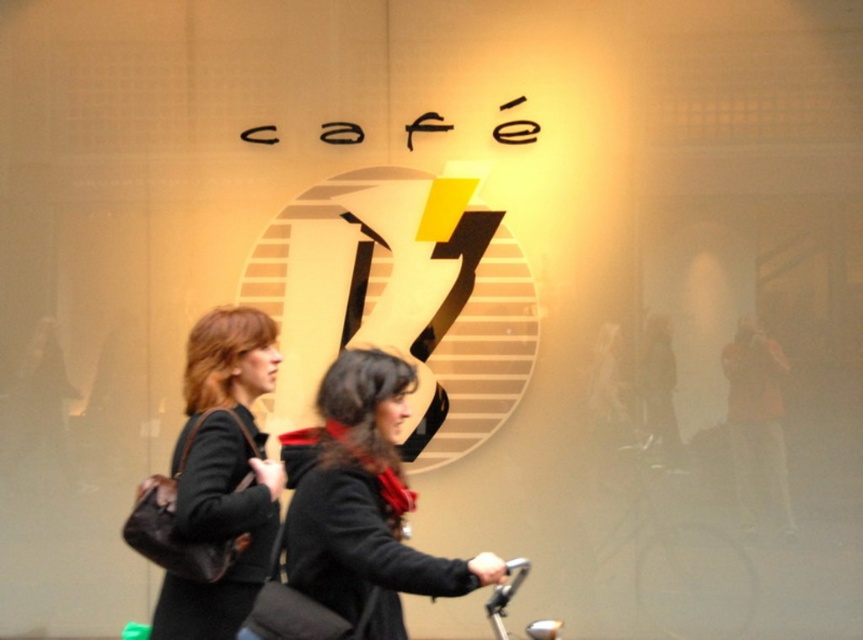
Question: Which point is farther from the camera taking this photo?

Choices:
 (A) (336, 461)
 (B) (203, 611)

Answer: (B)

Question: Which point is closer to the camera?

Choices:
 (A) (358, 568)
 (B) (210, 538)

Answer: (A)

Question: Can you confirm if black matte jacket at center is smaller than matte black bag at left?

Choices:
 (A) yes
 (B) no

Answer: (A)

Question: Is black matte jacket at center smaller than matte black bag at left?

Choices:
 (A) no
 (B) yes

Answer: (B)

Question: Can you confirm if black matte jacket at center is positioned above matte black bag at left?

Choices:
 (A) yes
 (B) no

Answer: (B)

Question: Which object appears closest to the camera in this image?

Choices:
 (A) matte black bag at left
 (B) black matte jacket at center

Answer: (B)